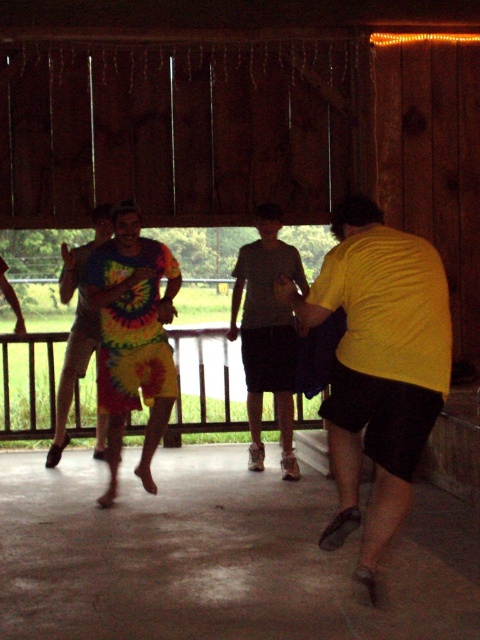
Question: Which point appears farthest from the camera in this image?

Choices:
 (A) (412, 328)
 (B) (113, 275)
 (C) (282, 321)
 (D) (82, 300)

Answer: (D)

Question: Does tie-dye shorts at center appear over gray cotton shirt at center?

Choices:
 (A) no
 (B) yes

Answer: (A)

Question: Is gray cotton shirt at center closer to camera compared to tie-dye shorts at left?

Choices:
 (A) yes
 (B) no

Answer: (A)

Question: Is tie-dye shorts at center to the left of gray cotton shirt at center from the viewer's perspective?

Choices:
 (A) no
 (B) yes

Answer: (B)

Question: Which object is positioned closest to the tie-dye shorts at left?

Choices:
 (A) tie-dye shorts at center
 (B) yellow matte shirt at right
 (C) gray cotton shirt at center

Answer: (A)

Question: Which object appears closest to the camera in this image?

Choices:
 (A) tie-dye shorts at left
 (B) tie-dye shorts at center

Answer: (B)